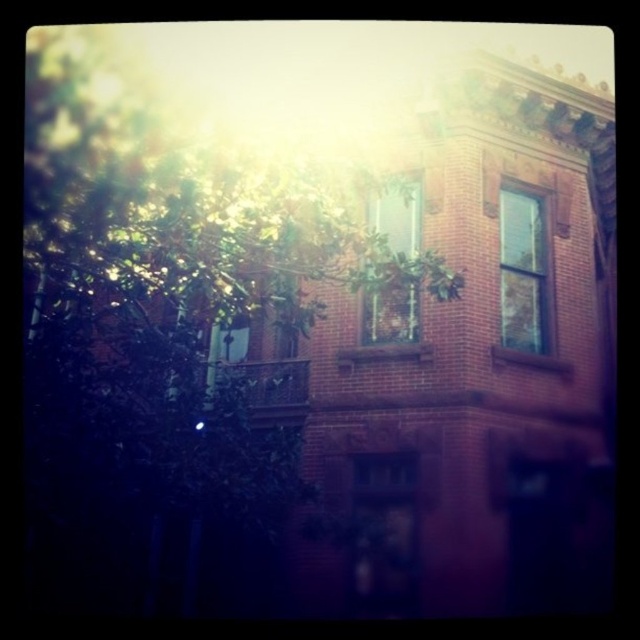
You are a window installer assessing the building. You have two clear glass windows to install. The first is labeled as the clear glass window at upper right and the second as the clear glass window at center. Given their sizes, which window should you place in the larger opening of the building?

The clear glass window at upper right is bigger than the clear glass window at center, so you should place the clear glass window at upper right in the larger opening of the building.

You are standing in front of the brick building and want to take a photo of the clear glass window at center without any obstruction. Considering the green leafy tree at upper left, will it block your view of the window?

The green leafy tree at upper left is larger in size than clear glass window at center, so it may block the view of the window depending on their positions.

You are a window installer who needs to replace the clear glass window at upper right located at point (524, 272). The building has a brick facade with ornate details. Can you determine the approximate height of the clear glass window at upper right based on its position relative to the brick building?

The clear glass window at upper right is located at point (524, 272), which is in the upper right section of the building. Since the building has multiple windows and a balcony on the second floor, the clear glass window at upper right is likely positioned on the second floor or higher, making its height approximately between 3 to 4 meters from the ground.